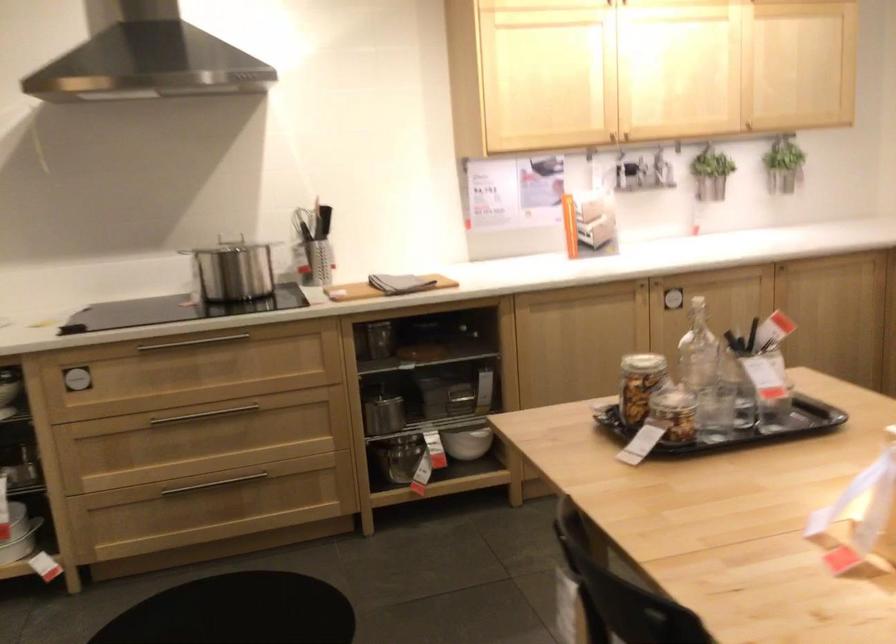
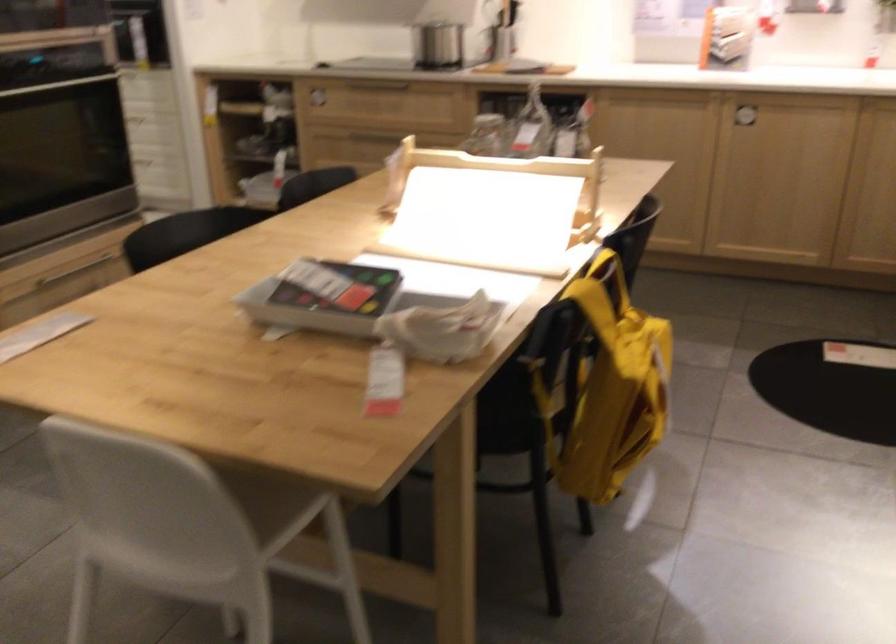
Question: I am providing you with two images of the same scene from different viewpoints. Please identify which objects are invisible in image2.

Choices:
 (A) white chair sitting surface
 (B) cabinet handle
 (C) metal bowl
 (D) yellow patterned pillow

Answer: (C)